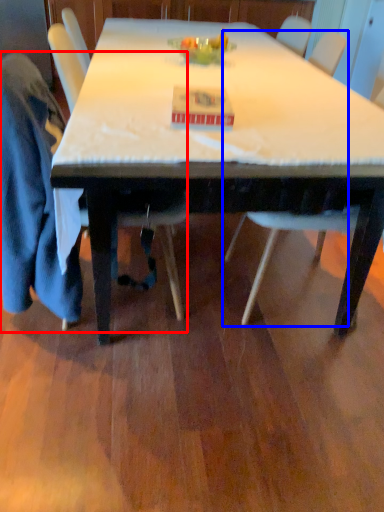
Question: Which object is further to the camera taking this photo, chair (highlighted by a red box) or chair (highlighted by a blue box)?

Choices:
 (A) chair
 (B) chair

Answer: (B)